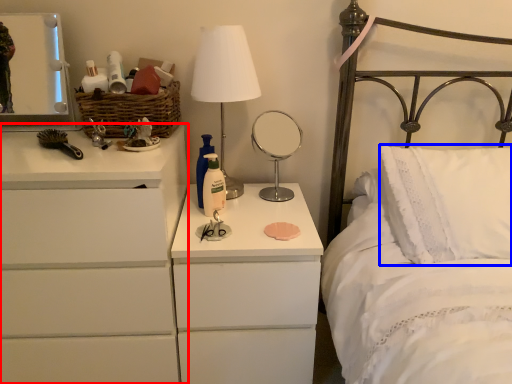
Question: Which point is further to the camera, chest of drawers (highlighted by a red box) or pillow (highlighted by a blue box)?

Choices:
 (A) chest of drawers
 (B) pillow

Answer: (B)